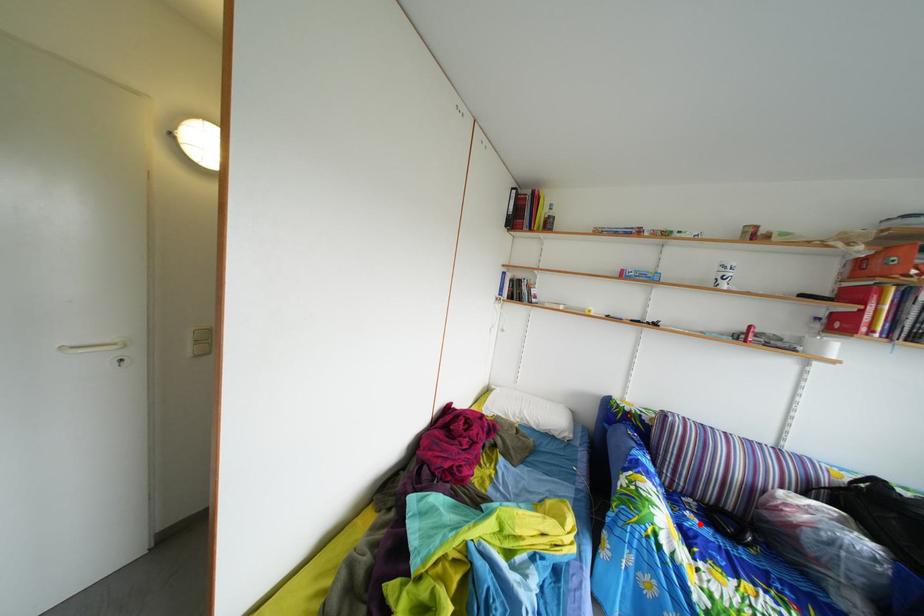
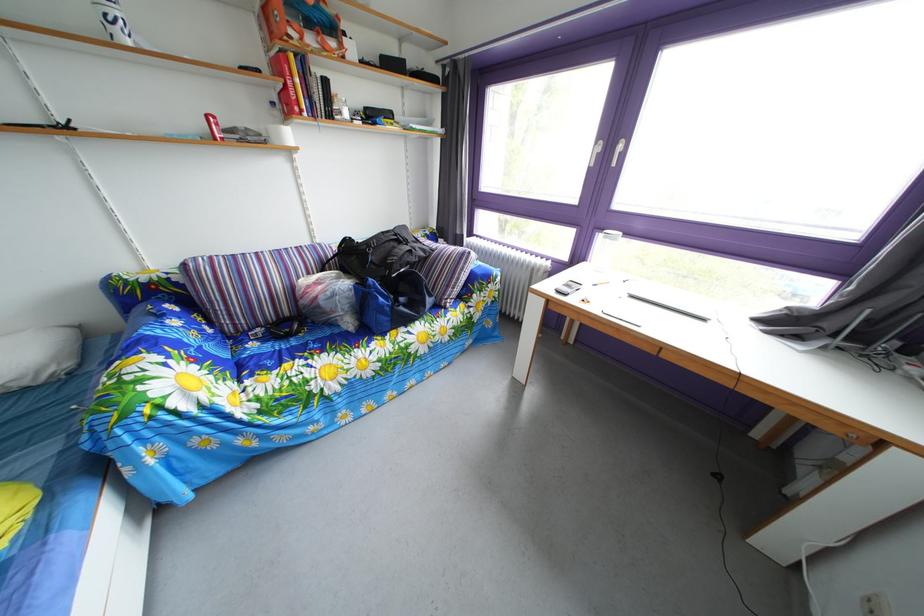
Find the pixel in the second image that matches the highlighted location in the first image.

(262, 353)